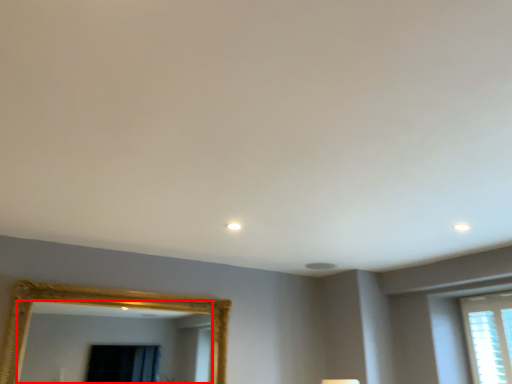
Question: From the image's perspective, where is mirror (annotated by the red box) located relative to window?

Choices:
 (A) below
 (B) above

Answer: (B)